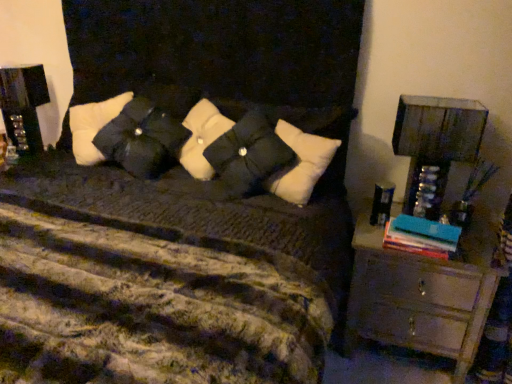
Question: Is teal matte book at right outside black glossy speaker at left?

Choices:
 (A) no
 (B) yes

Answer: (B)

Question: Is teal matte book at right beside black glossy speaker at left?

Choices:
 (A) yes
 (B) no

Answer: (B)

Question: Is teal matte book at right to the left of black glossy speaker at left from the viewer's perspective?

Choices:
 (A) yes
 (B) no

Answer: (B)

Question: Does teal matte book at right have a lesser width compared to black glossy speaker at left?

Choices:
 (A) no
 (B) yes

Answer: (B)

Question: Is teal matte book at right behind black glossy speaker at left?

Choices:
 (A) yes
 (B) no

Answer: (B)

Question: Based on their sizes in the image, would you say teal matte book at right is bigger or smaller than black matte pillow at center?

Choices:
 (A) small
 (B) big

Answer: (A)

Question: From the image's perspective, relative to black matte pillow at center, is teal matte book at right above or below?

Choices:
 (A) below
 (B) above

Answer: (A)

Question: Considering the positions of teal matte book at right and black matte pillow at center in the image, is teal matte book at right wider or thinner than black matte pillow at center?

Choices:
 (A) thin
 (B) wide

Answer: (A)

Question: Considering the relative positions of teal matte book at right and black matte pillow at center in the image provided, is teal matte book at right to the left or to the right of black matte pillow at center?

Choices:
 (A) left
 (B) right

Answer: (B)

Question: Is black glossy speaker at left wider or thinner than teal matte book at right?

Choices:
 (A) thin
 (B) wide

Answer: (B)

Question: In the image, is black glossy speaker at left positioned in front of or behind teal matte book at right?

Choices:
 (A) behind
 (B) front

Answer: (A)

Question: Which is correct: black glossy speaker at left is inside teal matte book at right, or outside of it?

Choices:
 (A) outside
 (B) inside

Answer: (A)

Question: From the image's perspective, is black glossy speaker at left located above or below teal matte book at right?

Choices:
 (A) above
 (B) below

Answer: (A)

Question: Is black glossy speaker at left taller or shorter than black matte pillow at center?

Choices:
 (A) short
 (B) tall

Answer: (B)

Question: Based on their sizes in the image, would you say black glossy speaker at left is bigger or smaller than black matte pillow at center?

Choices:
 (A) small
 (B) big

Answer: (A)